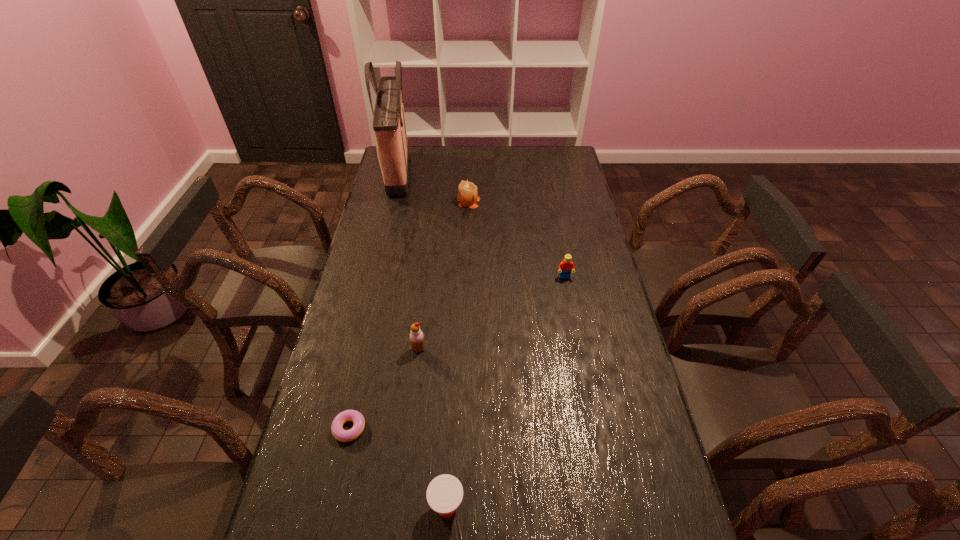
The height and width of the screenshot is (540, 960). Identify the location of the tallest object. (389, 127).

Identify the location of icecream. (416, 335).

At what (x,y) coordinates should I click in order to perform the action: click on the fourth object from right to left. Please return your answer as a coordinate pair (x, y). Looking at the image, I should click on (416, 335).

This screenshot has height=540, width=960. Identify the location of candle. (467, 196).

Where is `Lego`? This screenshot has width=960, height=540. Lego is located at coordinates (566, 266).

Identify the location of the fourth nearest object. Image resolution: width=960 pixels, height=540 pixels. (566, 266).

Where is `Dixie cup`? Dixie cup is located at coordinates (444, 494).

You are a GUI agent. You are given a task and a screenshot of the screen. Output one action in this format:
    pyautogui.click(x=<x>, y=<y>)
    Task: Click on the nearest object
    
    Given the screenshot: What is the action you would take?
    pyautogui.click(x=444, y=494)

Locate an element on the screen. The width and height of the screenshot is (960, 540). the fifth farthest object is located at coordinates (338, 432).

You are a GUI agent. You are given a task and a screenshot of the screen. Output one action in this format:
    pyautogui.click(x=<x>, y=<y>)
    Task: Click on the shortest object
    
    Given the screenshot: What is the action you would take?
    pyautogui.click(x=338, y=432)